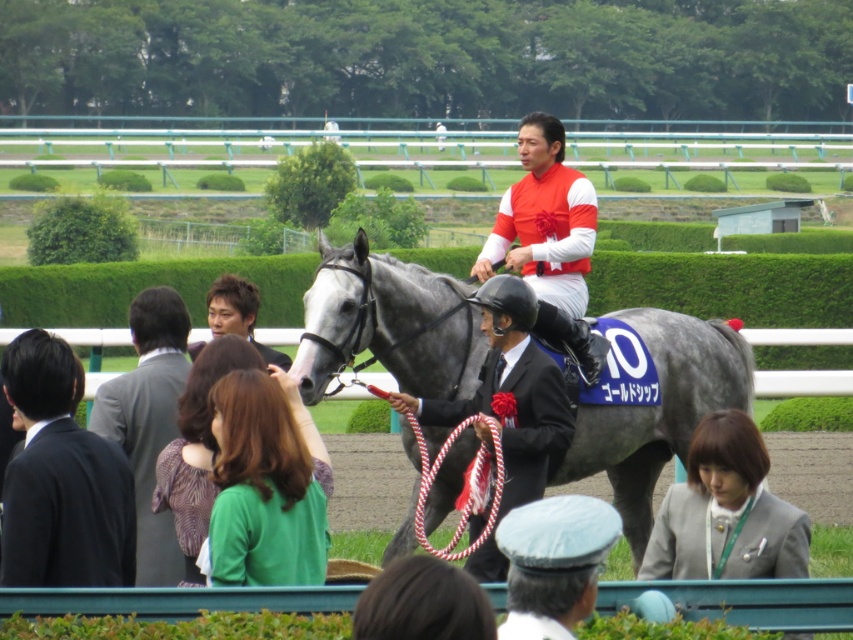
Question: Does gray suit at center appear over green leafy hedge at upper left?

Choices:
 (A) no
 (B) yes

Answer: (A)

Question: Which is farther from the gray glossy horse at center?

Choices:
 (A) light blue fabric cap at lower center
 (B) gray suit at center
 (C) black suit at left

Answer: (A)

Question: Is gray suit at center to the right of green leafy hedge at upper left from the viewer's perspective?

Choices:
 (A) yes
 (B) no

Answer: (A)

Question: Which object appears farthest from the camera in this image?

Choices:
 (A) black suit at left
 (B) gray suit at center
 (C) black glossy suit at center
 (D) light blue fabric cap at lower center

Answer: (B)

Question: Which of the following is the closest to the observer?

Choices:
 (A) (125, 493)
 (B) (491, 380)
 (C) (560, 525)

Answer: (C)

Question: Can you confirm if gray glossy horse at center is positioned below black glossy suit at center?

Choices:
 (A) yes
 (B) no

Answer: (B)